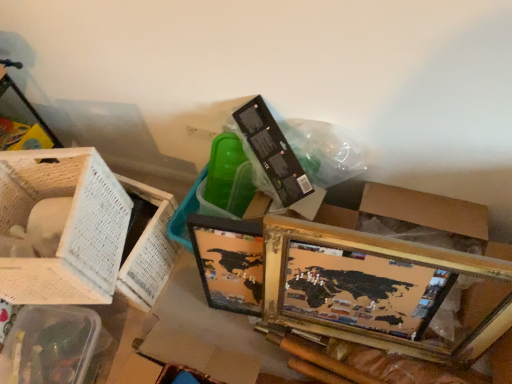
What do you see at coordinates (381, 290) in the screenshot?
I see `gold-framed map at lower right` at bounding box center [381, 290].

The width and height of the screenshot is (512, 384). I want to click on white woven basket at left, which appears as the 1th basket when viewed from the top, so click(64, 226).

Could you tell me if white woven basket at left, which is the second basket from bottom to top, is facing clear plastic basket at lower left, which appears as the 2th basket when viewed from the top?

No.

Between white woven basket at left, which is the second basket from bottom to top, and clear plastic basket at lower left, which appears as the 2th basket when viewed from the top, which one has larger size?

white woven basket at left, which is the second basket from bottom to top, is bigger.

From the image's perspective, which one is positioned lower, white woven basket at left, which appears as the 1th basket when viewed from the top, or clear plastic basket at lower left, which is counted as the 1th basket, starting from the bottom?

clear plastic basket at lower left, which is counted as the 1th basket, starting from the bottom, appears lower in the image.

Is gold-framed map at lower right facing away from white woven basket at left, which is the second basket from bottom to top?

No.

Is gold-framed map at lower right to the right of white woven basket at left, which is the second basket from bottom to top, from the viewer's perspective?

Result: Yes, gold-framed map at lower right is to the right of white woven basket at left, which is the second basket from bottom to top.

From the image's perspective, is gold-framed map at lower right beneath white woven basket at left, which appears as the 1th basket when viewed from the top?

Correct, gold-framed map at lower right appears lower than white woven basket at left, which appears as the 1th basket when viewed from the top, in the image.

Is gold-framed map at lower right inside the boundaries of white woven basket at left, which is the second basket from bottom to top, or outside?

gold-framed map at lower right is not enclosed by white woven basket at left, which is the second basket from bottom to top.

Can you tell me how much white woven basket at left, which is the second basket from bottom to top, and gold-framed map at lower right differ in facing direction?

The facing directions of white woven basket at left, which is the second basket from bottom to top, and gold-framed map at lower right are 12.2 degrees apart.

Is white woven basket at left, which appears as the 1th basket when viewed from the top, not close to gold-framed map at lower right?

white woven basket at left, which appears as the 1th basket when viewed from the top, is actually quite close to gold-framed map at lower right.

From the picture: From the image's perspective, is white woven basket at left, which is the second basket from bottom to top, positioned above or below gold-framed map at lower right?

white woven basket at left, which is the second basket from bottom to top, is situated higher than gold-framed map at lower right in the image.

Which is nearer, (73,210) or (350,333)?

Point (73,210).

From a real-world perspective, which object rests below the other?

In real-world perspective, clear plastic basket at lower left, which is counted as the 1th basket, starting from the bottom, is lower.

Would you say clear plastic basket at lower left, which is counted as the 1th basket, starting from the bottom, is outside gold-framed map at lower right?

That's correct, clear plastic basket at lower left, which is counted as the 1th basket, starting from the bottom, is outside of gold-framed map at lower right.

Image resolution: width=512 pixels, height=384 pixels. Find the location of `picture frame on the right side of clear plastic basket at lower left, which is counted as the 1th basket, starting from the bottom`. picture frame on the right side of clear plastic basket at lower left, which is counted as the 1th basket, starting from the bottom is located at coordinates (381, 290).

Could you measure the distance between clear plastic basket at lower left, which is counted as the 1th basket, starting from the bottom, and gold-framed map at lower right?

They are 30.87 inches apart.

Can you confirm if gold-framed map at lower right is positioned to the left of clear plastic basket at lower left, which appears as the 2th basket when viewed from the top?

No.

Which is in front, point (414, 326) or point (71, 346)?

The point (414, 326) is more forward.

I want to click on picture frame above the clear plastic basket at lower left, which appears as the 2th basket when viewed from the top (from the image's perspective), so click(x=381, y=290).

Is gold-framed map at lower right bigger than clear plastic basket at lower left, which is counted as the 1th basket, starting from the bottom?

Indeed, gold-framed map at lower right has a larger size compared to clear plastic basket at lower left, which is counted as the 1th basket, starting from the bottom.

From the image's perspective, would you say clear plastic basket at lower left, which appears as the 2th basket when viewed from the top, is positioned over white woven basket at left, which is the second basket from bottom to top?

Incorrect, from the image's perspective, clear plastic basket at lower left, which appears as the 2th basket when viewed from the top, is lower than white woven basket at left, which is the second basket from bottom to top.

Could you tell me if clear plastic basket at lower left, which is counted as the 1th basket, starting from the bottom, is turned towards white woven basket at left, which appears as the 1th basket when viewed from the top?

No, clear plastic basket at lower left, which is counted as the 1th basket, starting from the bottom, is not aimed at white woven basket at left, which appears as the 1th basket when viewed from the top.

Is clear plastic basket at lower left, which appears as the 2th basket when viewed from the top, thinner than white woven basket at left, which appears as the 1th basket when viewed from the top?

Yes.

Measure the distance from clear plastic basket at lower left, which is counted as the 1th basket, starting from the bottom, to white woven basket at left, which appears as the 1th basket when viewed from the top.

The distance of clear plastic basket at lower left, which is counted as the 1th basket, starting from the bottom, from white woven basket at left, which appears as the 1th basket when viewed from the top, is 11.94 inches.

In order to click on basket that is behind the white woven basket at left, which is the second basket from bottom to top in this screenshot , I will do `click(51, 345)`.

Find the location of a particular element. basket above the gold-framed map at lower right (from the image's perspective) is located at coordinates (64, 226).

Looking at the image, which one is located closer to gold-framed map at lower right, white woven basket at left, which is the second basket from bottom to top, or clear plastic basket at lower left, which appears as the 2th basket when viewed from the top?

white woven basket at left, which is the second basket from bottom to top, is positioned closer to the anchor gold-framed map at lower right.

Based on their spatial positions, is clear plastic basket at lower left, which is counted as the 1th basket, starting from the bottom, or white woven basket at left, which is the second basket from bottom to top, further from gold-framed map at lower right?

clear plastic basket at lower left, which is counted as the 1th basket, starting from the bottom, is positioned further to the anchor gold-framed map at lower right.

From the image, which object appears to be farther from white woven basket at left, which appears as the 1th basket when viewed from the top, clear plastic basket at lower left, which is counted as the 1th basket, starting from the bottom, or gold-framed map at lower right?

gold-framed map at lower right is positioned further to the anchor white woven basket at left, which appears as the 1th basket when viewed from the top.

When comparing their distances from clear plastic basket at lower left, which is counted as the 1th basket, starting from the bottom, does white woven basket at left, which appears as the 1th basket when viewed from the top, or gold-framed map at lower right seem further?

Based on the image, gold-framed map at lower right appears to be further to clear plastic basket at lower left, which is counted as the 1th basket, starting from the bottom.

From the image, which object appears to be farther from white woven basket at left, which is the second basket from bottom to top, gold-framed map at lower right or clear plastic basket at lower left, which appears as the 2th basket when viewed from the top?

gold-framed map at lower right is further to white woven basket at left, which is the second basket from bottom to top.

Looking at the image, which one is located closer to clear plastic basket at lower left, which is counted as the 1th basket, starting from the bottom, gold-framed map at lower right or white woven basket at left, which appears as the 1th basket when viewed from the top?

Among the two, white woven basket at left, which appears as the 1th basket when viewed from the top, is located nearer to clear plastic basket at lower left, which is counted as the 1th basket, starting from the bottom.

The height and width of the screenshot is (384, 512). I want to click on basket situated between clear plastic basket at lower left, which appears as the 2th basket when viewed from the top, and gold-framed map at lower right from left to right, so click(x=64, y=226).